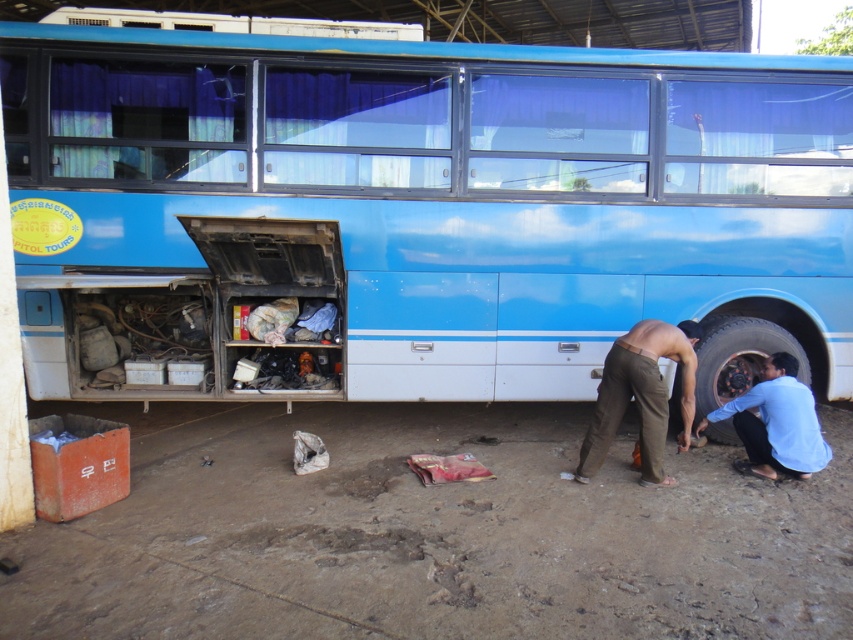
Is blue matte bus at center closer to the viewer compared to brown cotton pants at lower center?

No, it is behind brown cotton pants at lower center.

Does blue matte bus at center appear on the left side of brown cotton pants at lower center?

Correct, you'll find blue matte bus at center to the left of brown cotton pants at lower center.

Identify the location of blue matte bus at center. The image size is (853, 640). (410, 209).

The image size is (853, 640). What are the coordinates of `blue matte bus at center` in the screenshot? It's located at (410, 209).

Is point (358, 202) in front of point (709, 412)?

Yes, it is in front of point (709, 412).

Who is shorter, blue matte bus at center or blue cotton shirt at lower right?

blue cotton shirt at lower right is shorter.

Which is behind, point (163, 83) or point (791, 432)?

The point (163, 83) is behind.

At what (x,y) coordinates should I click in order to perform the action: click on blue matte bus at center. Please return your answer as a coordinate pair (x, y). This screenshot has width=853, height=640. Looking at the image, I should click on (410, 209).

Who is positioned more to the right, brown cotton pants at lower center or rustic metal tire at lower right?

rustic metal tire at lower right

Is point (599, 452) closer to camera compared to point (672, 392)?

Yes, it is.

Locate an element on the screen. brown cotton pants at lower center is located at coordinates (641, 396).